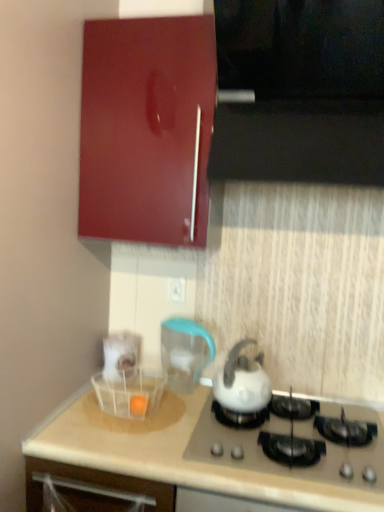
Question: In the image, is white glossy kettle at center positioned in front of or behind black glossy vent at upper center?

Choices:
 (A) front
 (B) behind

Answer: (B)

Question: Looking at the image, does white glossy kettle at center seem bigger or smaller compared to black glossy vent at upper center?

Choices:
 (A) big
 (B) small

Answer: (B)

Question: Which is nearer to the white glossy kettle at center?

Choices:
 (A) black glossy vent at upper center
 (B) white plastic drawer at lower left
 (C) white plastic electric outlet at center
 (D) transparent plastic blender at center
 (E) white glossy gas stove at lower center

Answer: (E)

Question: Which object is the closest to the white plastic drawer at lower left?

Choices:
 (A) glossy wood cabinet at upper left
 (B) white glossy gas stove at lower center
 (C) transparent plastic blender at center
 (D) black glossy vent at upper center
 (E) white plastic electric outlet at center

Answer: (B)